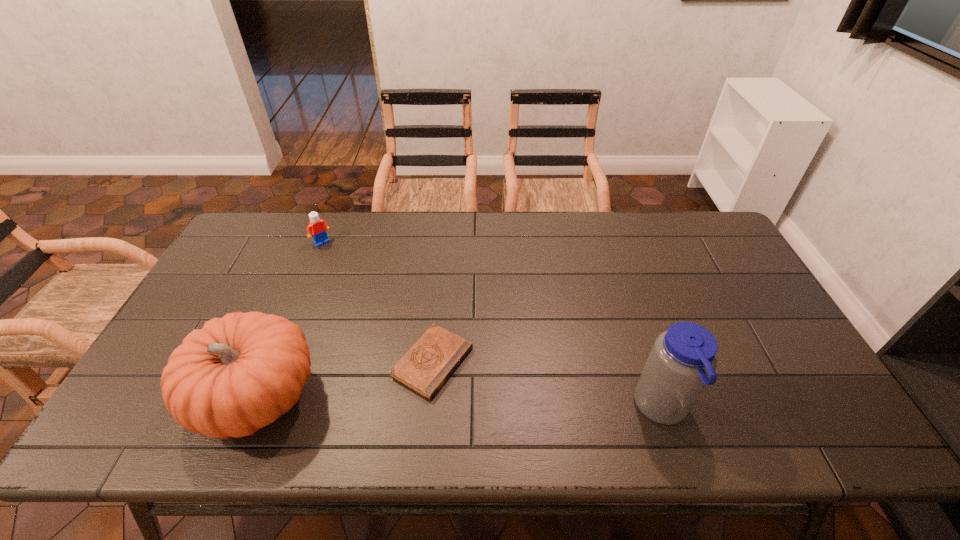
The height and width of the screenshot is (540, 960). Identify the location of vacant point that satisfies the following two spatial constraints: 1. on the front side of the tallest object; 2. with a carrying loop on the side of the pumpkin. (253, 408).

Find the location of a particular element. This screenshot has height=540, width=960. vacant space that satisfies the following two spatial constraints: 1. on the front side of the third shortest object; 2. with a carrying loop on the side of the water bottle is located at coordinates (253, 408).